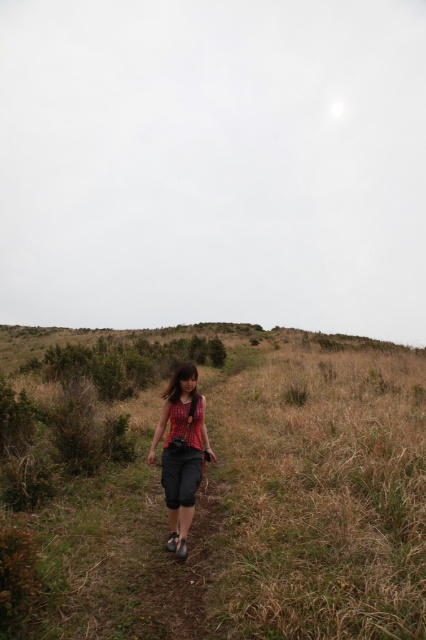
Question: Does dry grass at center appear over matte black tank top at center?

Choices:
 (A) no
 (B) yes

Answer: (A)

Question: Does dry grass at center have a lesser width compared to matte black tank top at center?

Choices:
 (A) yes
 (B) no

Answer: (B)

Question: Among these points, which one is farthest from the camera?

Choices:
 (A) (199, 477)
 (B) (17, 419)

Answer: (B)

Question: Among these objects, which one is nearest to the camera?

Choices:
 (A) dry grass at center
 (B) matte black tank top at center

Answer: (A)

Question: Can you confirm if dry grass at center is wider than matte black tank top at center?

Choices:
 (A) no
 (B) yes

Answer: (B)